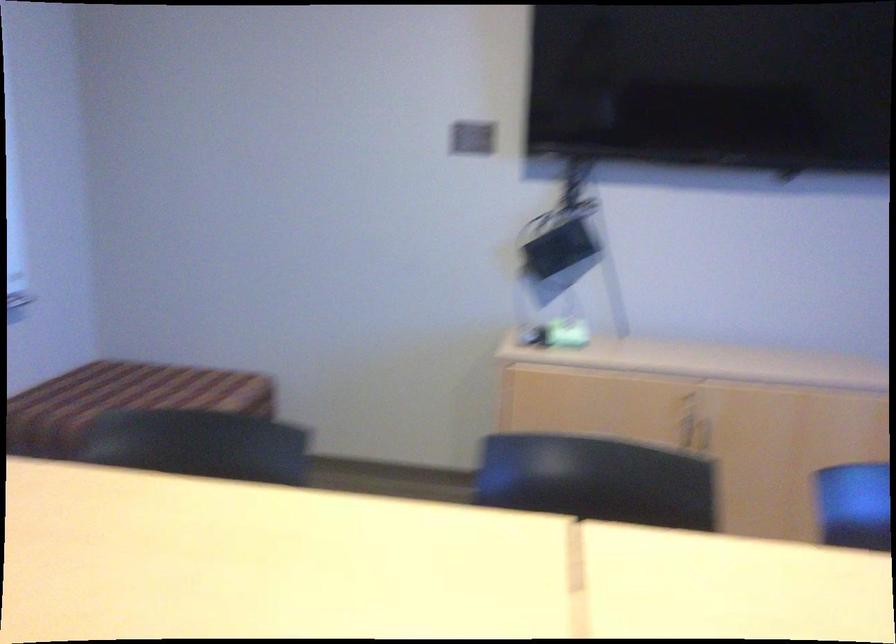
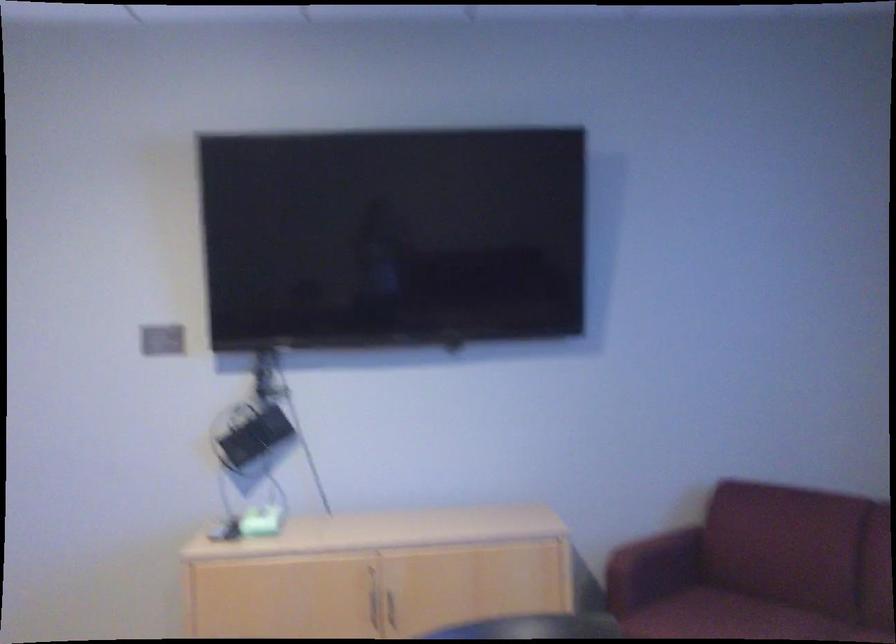
Locate, in the second image, the point that corresponds to point (698, 433) in the first image.

(392, 607)